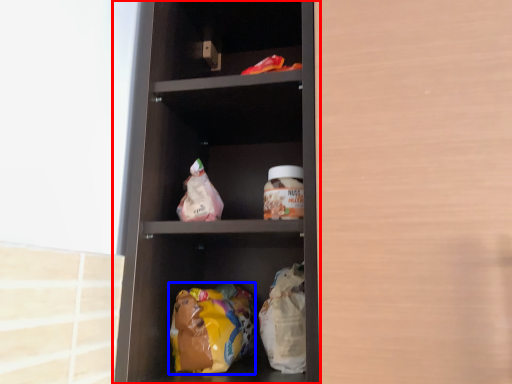
Question: Which of the following is the farthest to the observer, shelf (highlighted by a red box) or food (highlighted by a blue box)?

Choices:
 (A) shelf
 (B) food

Answer: (B)